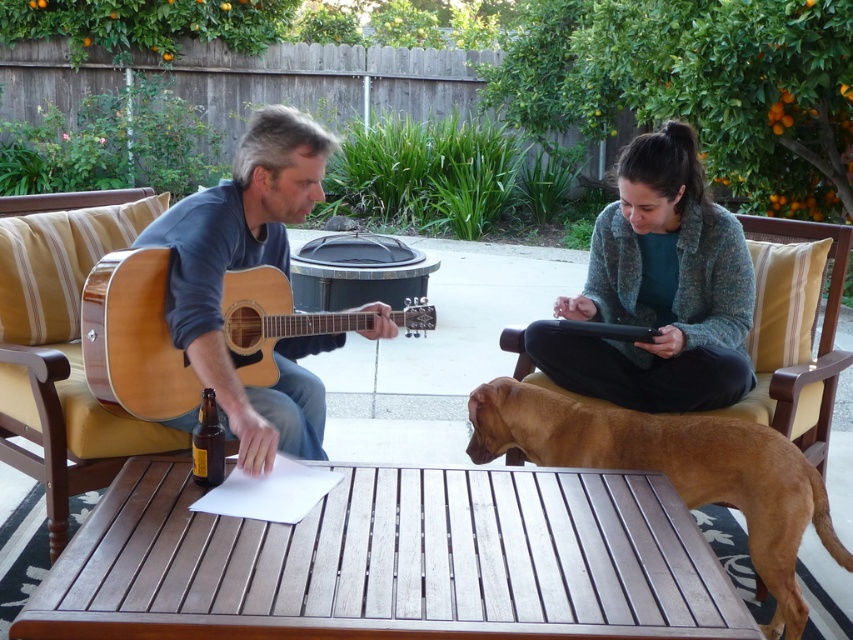
Question: Which point appears farthest from the camera in this image?

Choices:
 (A) (750, 540)
 (B) (582, 292)
 (C) (431, 308)
 (D) (294, 435)

Answer: (B)

Question: Does green textured sweater at upper right appear over natural wood acoustic guitar at left?

Choices:
 (A) no
 (B) yes

Answer: (B)

Question: Is brown smooth dog at lower center positioned behind natural wood acoustic guitar at left?

Choices:
 (A) yes
 (B) no

Answer: (B)

Question: Which point appears closest to the camera in this image?

Choices:
 (A) (776, 458)
 (B) (144, 257)
 (C) (271, 410)

Answer: (A)

Question: Which object is closer to the camera taking this photo?

Choices:
 (A) green textured sweater at upper right
 (B) matte wood guitar at left

Answer: (B)

Question: Is matte wood guitar at left positioned at the back of natural wood acoustic guitar at left?

Choices:
 (A) yes
 (B) no

Answer: (B)